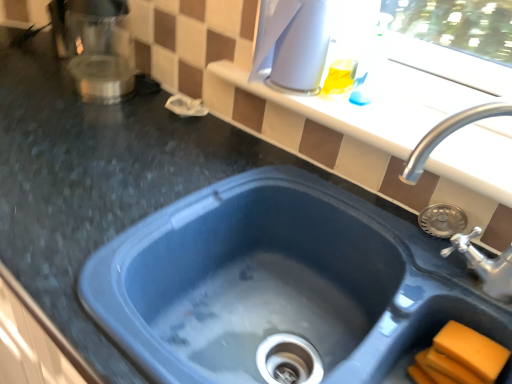
Question: Do you think blue plastic sink at center, the 1th sink viewed from the left, is within blue plastic sink at upper right, positioned as the first sink in right-to-left order, or outside of it?

Choices:
 (A) outside
 (B) inside

Answer: (A)

Question: Considering the relative positions of blue plastic sink at center, the 1th sink viewed from the left, and blue plastic sink at upper right, positioned as the first sink in right-to-left order, in the image provided, is blue plastic sink at center, the 1th sink viewed from the left, to the left or to the right of blue plastic sink at upper right, positioned as the first sink in right-to-left order,?

Choices:
 (A) right
 (B) left

Answer: (B)

Question: Estimate the real-world distances between objects in this image. Which object is farther from the white glossy window sill at upper center?

Choices:
 (A) blue plastic sink at upper right, which appears as the 2th sink when viewed from the left
 (B) orange sponge at lower right
 (C) satin silver coffee maker at upper left, which is the second appliance in right-to-left order
 (D) white glossy kettle at upper center, placed as the 2th appliance when sorted from left to right
 (E) blue plastic sink at center, the 1th sink viewed from the left

Answer: (C)

Question: Estimate the real-world distances between objects in this image. Which object is closer to the orange sponge at lower right?

Choices:
 (A) satin silver coffee maker at upper left, which is the first appliance from left to right
 (B) blue plastic sink at upper right, which appears as the 2th sink when viewed from the left
 (C) white glossy window sill at upper center
 (D) blue plastic sink at center, the 1th sink viewed from the left
 (E) white glossy kettle at upper center, placed as the 2th appliance when sorted from left to right

Answer: (B)